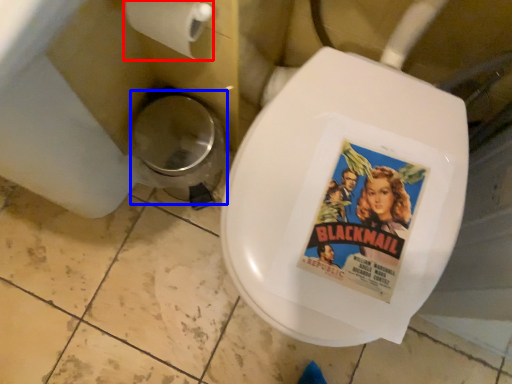
Question: Which of the following is the closest to the observer, toilet paper (highlighted by a red box) or potty (highlighted by a blue box)?

Choices:
 (A) toilet paper
 (B) potty

Answer: (A)